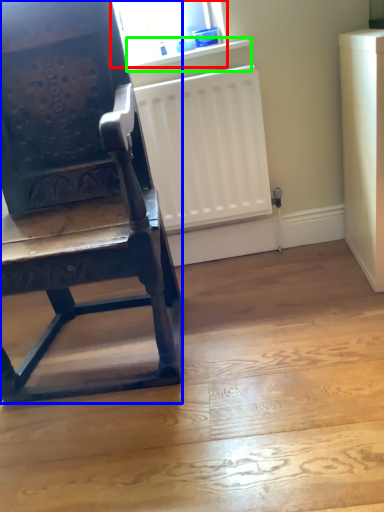
Question: Considering the real-world distances, which object is farthest from window screen (highlighted by a red box)? chair (highlighted by a blue box) or window sill (highlighted by a green box)?

Choices:
 (A) chair
 (B) window sill

Answer: (A)